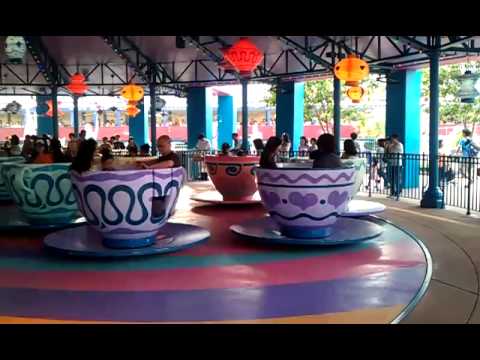
Find the location of a particular element. The image size is (480, 360). yellow hanging decorative ball is located at coordinates (352, 71), (131, 88).